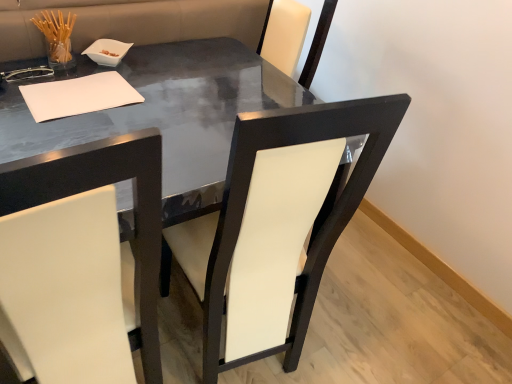
The width and height of the screenshot is (512, 384). In order to click on free location to the right of white paper at upper left in this screenshot , I will do `click(165, 107)`.